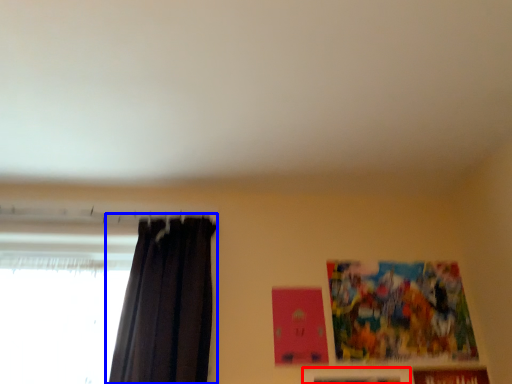
Question: Which point is further to the camera, picture frame (highlighted by a red box) or curtain (highlighted by a blue box)?

Choices:
 (A) picture frame
 (B) curtain

Answer: (A)